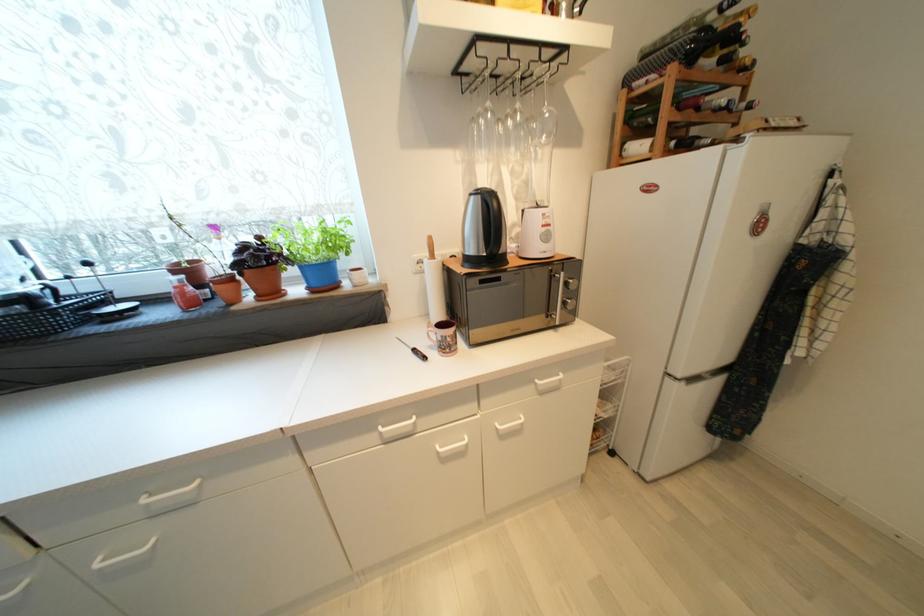
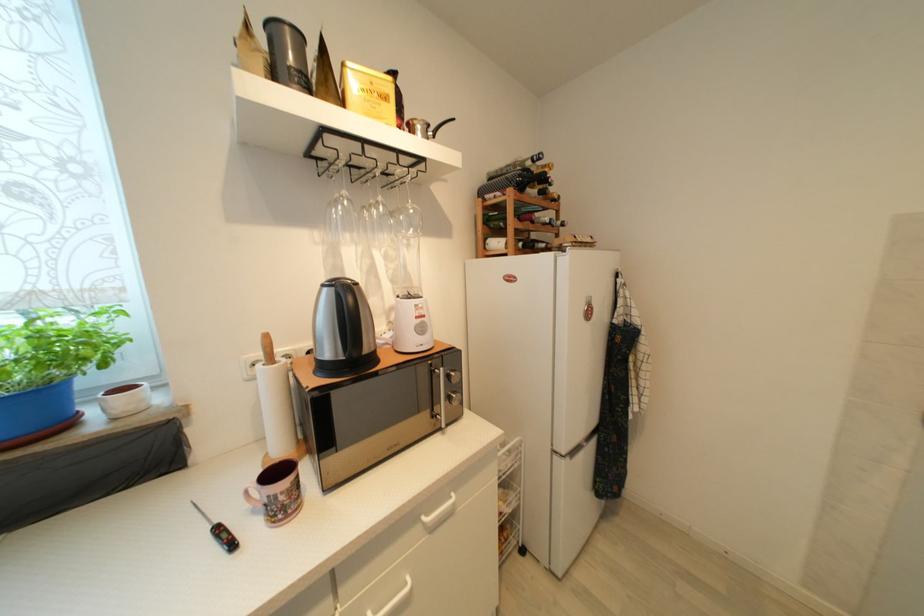
The point at (569, 305) is marked in the first image. Where is the corresponding point in the second image?

(455, 400)